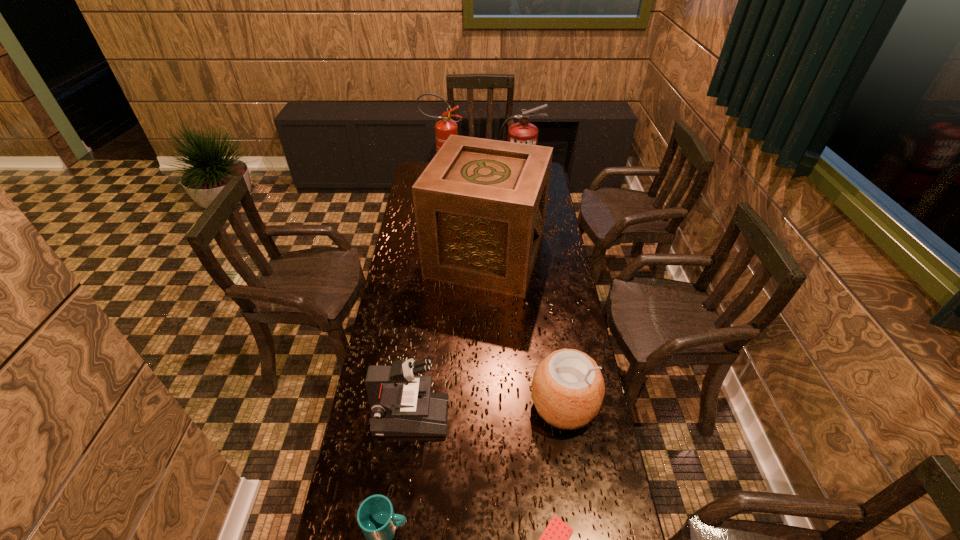
Locate an element on the screen. The width and height of the screenshot is (960, 540). vacant space in between the left fire extinguisher and the microscope is located at coordinates (428, 301).

Locate an element on the screen. vacant region between the coconut and the box is located at coordinates (525, 329).

Where is `empty location between the right fire extinguisher and the microscope`? empty location between the right fire extinguisher and the microscope is located at coordinates (465, 305).

Where is `unoccupied area between the third farthest object and the microscope`? unoccupied area between the third farthest object and the microscope is located at coordinates (449, 335).

The width and height of the screenshot is (960, 540). Find the location of `free space between the box and the microscope`. free space between the box and the microscope is located at coordinates [x=449, y=335].

Find the location of `object that stands as the closest to the shortest object`. object that stands as the closest to the shortest object is located at coordinates (567, 389).

At what (x,y) coordinates should I click in order to perform the action: click on object that is the fifth closest to the coconut. Please return your answer as a coordinate pair (x, y). Looking at the image, I should click on (523, 132).

Where is `blank area in the image that satisfies the following two spatial constraints: 1. on the front side of the fifth nearest object; 2. through the eyepieces of the microscope`? blank area in the image that satisfies the following two spatial constraints: 1. on the front side of the fifth nearest object; 2. through the eyepieces of the microscope is located at coordinates (489, 416).

The width and height of the screenshot is (960, 540). Identify the location of vacant area that satisfies the following two spatial constraints: 1. on the front side of the coconut; 2. on the right side of the fifth nearest object. (489, 405).

Find the location of a particular element. The image size is (960, 540). free spot that satisfies the following two spatial constraints: 1. on the back side of the third farthest object; 2. from the nozzle of the left fire extinguisher is located at coordinates click(485, 185).